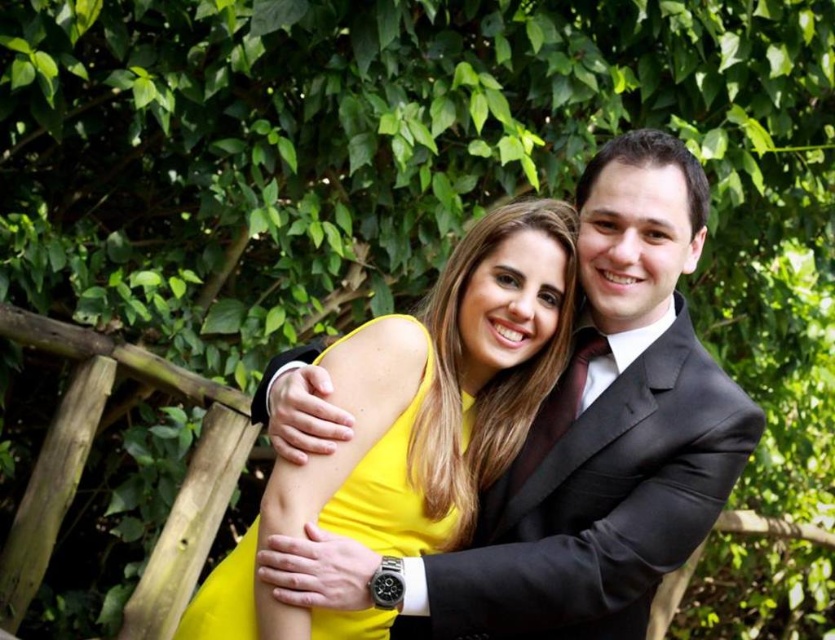
You are a photographer trying to capture a portrait of the two people in the image. You want to ensure that both the satin black suit at center and the yellow satin dress at center are clearly visible in the photo. Given their positions, which clothing item is positioned higher in the frame?

The satin black suit at center is located above the yellow satin dress at center, so it is positioned higher in the frame.

You are a photographer trying to capture the perfect shot of the scene. You notice a point at coordinates (600,508). What object is located at that point?

The point at coordinates (600,508) marks the location of the satin black suit at center.